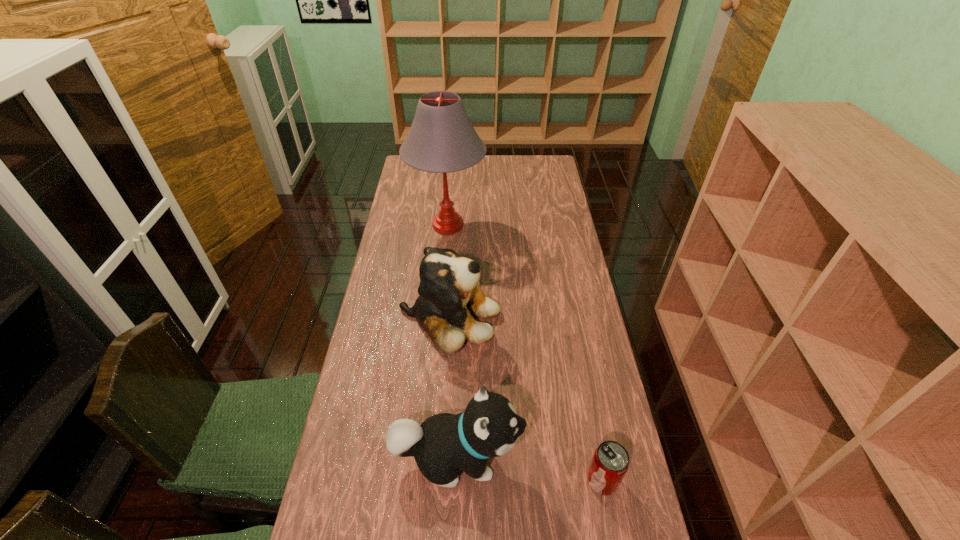
Find the location of a particular element. Image resolution: width=960 pixels, height=540 pixels. free space that satisfies the following two spatial constraints: 1. on the front-facing side of the table lamp; 2. on the right side of the pop soda is located at coordinates (426, 480).

Image resolution: width=960 pixels, height=540 pixels. In order to click on vacant region that satisfies the following two spatial constraints: 1. at the face of the farther puppy; 2. on the back side of the rightmost object in this screenshot , I will do `click(439, 480)`.